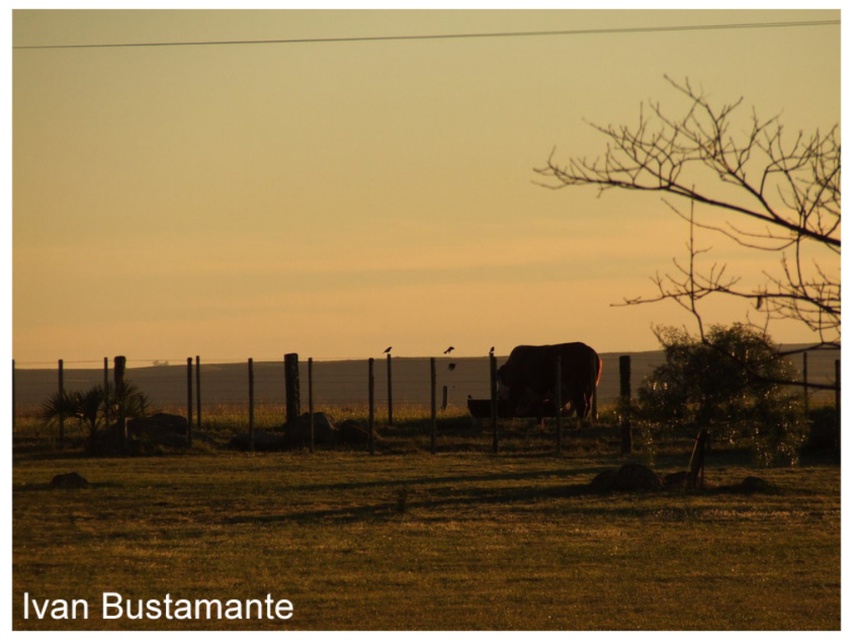
You are a bird flying over a rural area and want to land between the brown bare branches at upper right and the green leafy tree at right. How far apart are these two trees?

The brown bare branches at upper right and the green leafy tree at right are 54.77 feet apart from each other.

You are a farmer who wants to ensure the brown matte bull at center can pass through the metallic wire fence at center. Based on the scene description, can the bull go through the fence?

The metallic wire fence at center has a larger size compared to brown matte bull at center, so the bull can pass through the fence.